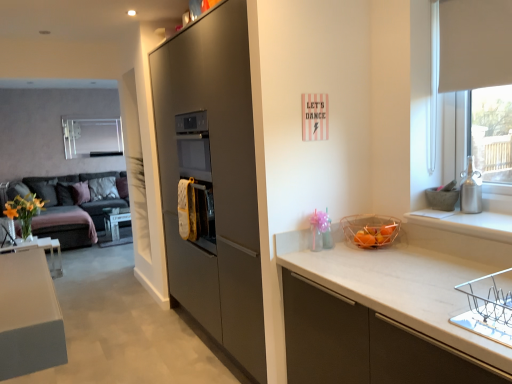
Question: Is satin silver vase at right completely or partially inside matte gray pillow at left, placed as the 1th pillow when sorted from left to right?

Choices:
 (A) no
 (B) yes

Answer: (A)

Question: Is the position of matte gray pillow at left, which is counted as the 2th pillow, starting from the right, more distant than that of satin silver vase at right?

Choices:
 (A) yes
 (B) no

Answer: (A)

Question: Does matte gray pillow at left, placed as the 1th pillow when sorted from left to right, have a greater height compared to satin silver vase at right?

Choices:
 (A) no
 (B) yes

Answer: (B)

Question: Is matte gray pillow at left, placed as the 1th pillow when sorted from left to right, at the left side of satin silver vase at right?

Choices:
 (A) yes
 (B) no

Answer: (A)

Question: Does matte gray pillow at left, placed as the 1th pillow when sorted from left to right, have a greater width compared to satin silver vase at right?

Choices:
 (A) no
 (B) yes

Answer: (B)

Question: Is matte gray pillow at left, which is counted as the 2th pillow, starting from the right, thinner than satin silver vase at right?

Choices:
 (A) yes
 (B) no

Answer: (B)

Question: Is matte gray cabinet at center at the back of translucent plastic basket at right?

Choices:
 (A) yes
 (B) no

Answer: (B)

Question: Is the depth of translucent plastic basket at right greater than that of matte gray cabinet at center?

Choices:
 (A) no
 (B) yes

Answer: (B)

Question: Does translucent plastic basket at right have a lesser height compared to matte gray cabinet at center?

Choices:
 (A) yes
 (B) no

Answer: (A)

Question: From the image's perspective, is translucent plastic basket at right above matte gray cabinet at center?

Choices:
 (A) yes
 (B) no

Answer: (B)

Question: From a real-world perspective, is translucent plastic basket at right on top of matte gray cabinet at center?

Choices:
 (A) no
 (B) yes

Answer: (A)

Question: Is translucent plastic basket at right far from matte gray cabinet at center?

Choices:
 (A) no
 (B) yes

Answer: (A)

Question: Is white fabric pillow at left, which ranks as the 1th pillow in right-to-left order, positioned behind dark gray fabric couch at left?

Choices:
 (A) yes
 (B) no

Answer: (A)